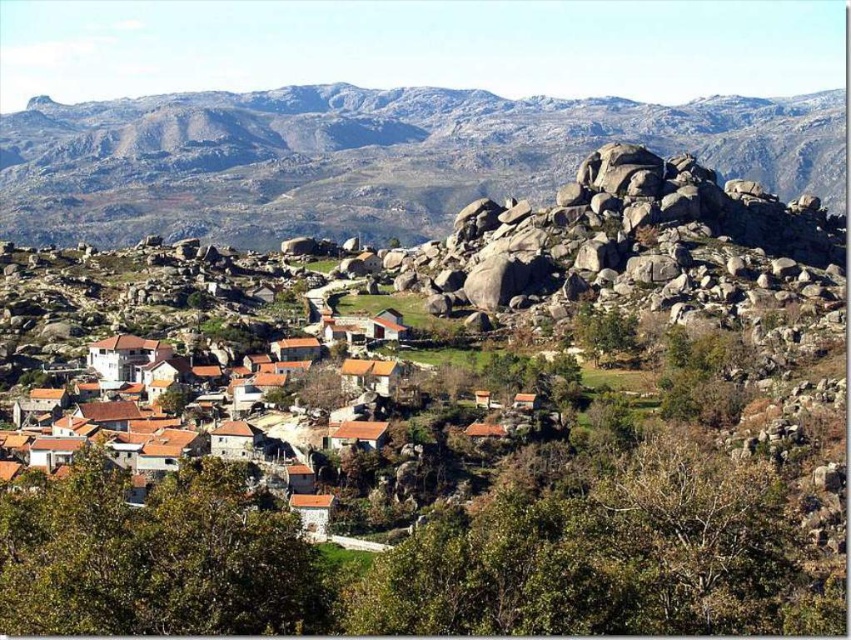
Question: Among these points, which one is farthest from the camera?

Choices:
 (A) (40, 145)
 (B) (146, 451)

Answer: (A)

Question: Is the position of granite boulders at upper center less distant than that of brown clay houses at center?

Choices:
 (A) yes
 (B) no

Answer: (B)

Question: Which point is closer to the camera?

Choices:
 (A) (280, 180)
 (B) (147, 477)

Answer: (B)

Question: Is granite boulders at upper center to the left of brown clay houses at center from the viewer's perspective?

Choices:
 (A) no
 (B) yes

Answer: (A)

Question: Is granite boulders at upper center wider than brown clay houses at center?

Choices:
 (A) no
 (B) yes

Answer: (B)